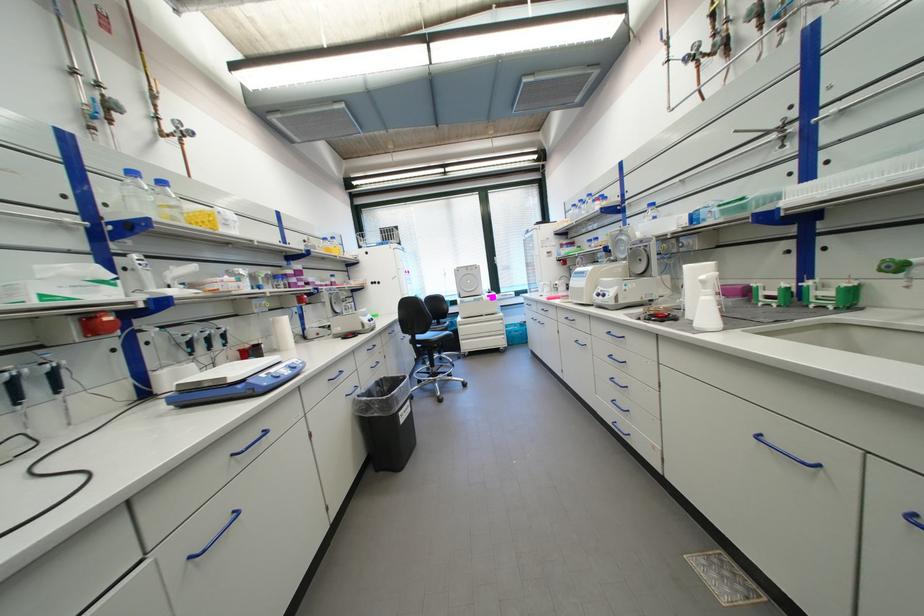
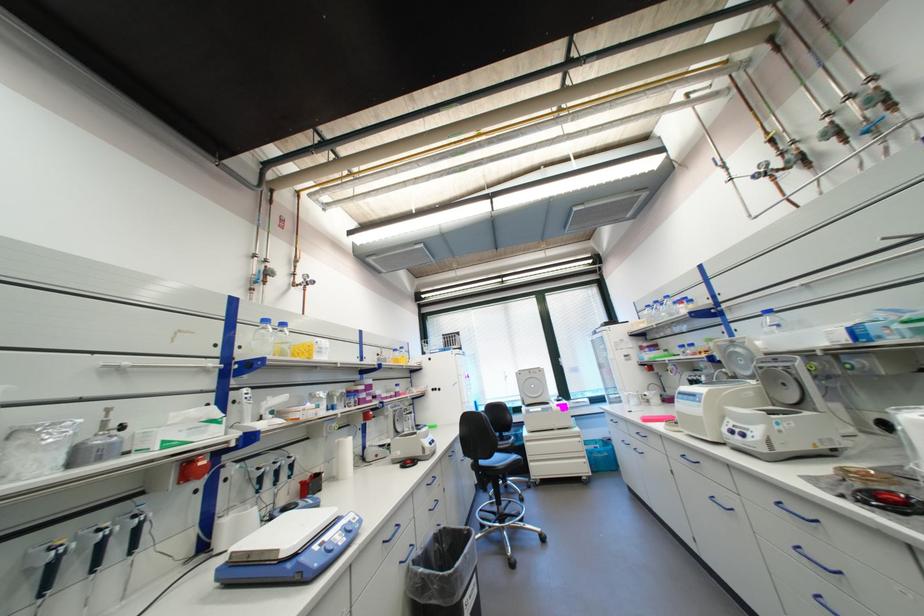
Locate, in the second image, the point that corresponds to point 138,180 in the first image.

(271, 326)